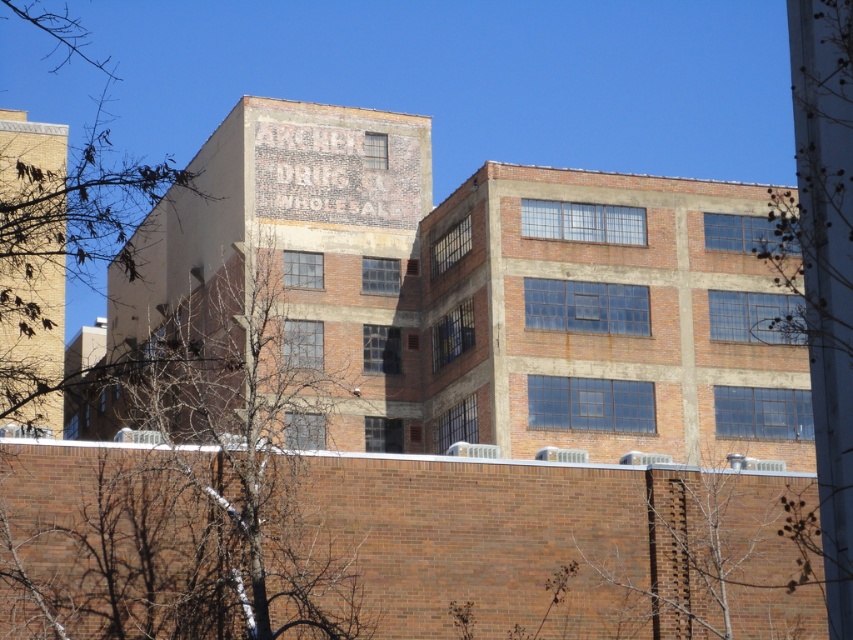
You are a window cleaner standing on the ground in front of the large brick building. You see the bare branches at center and the brown textured tree at lower right. Which object is taller?

The bare branches at center is much taller than the brown textured tree at lower right.

You are a city planner assessing the urban space. You notice the brown textured tree at lower right and the bare branches at right. Which of these two has a wider spread in terms of horizontal coverage?

The bare branches at right have a wider spread than the brown textured tree at lower right, as the brown textured tree at lower right is narrower in width.